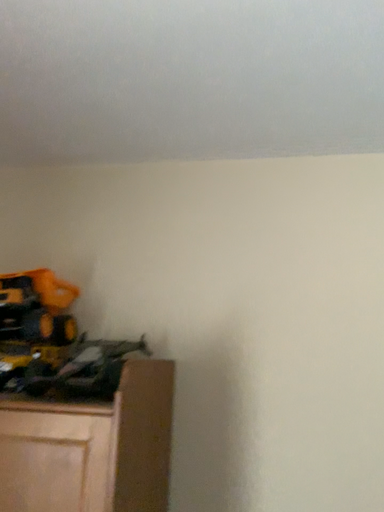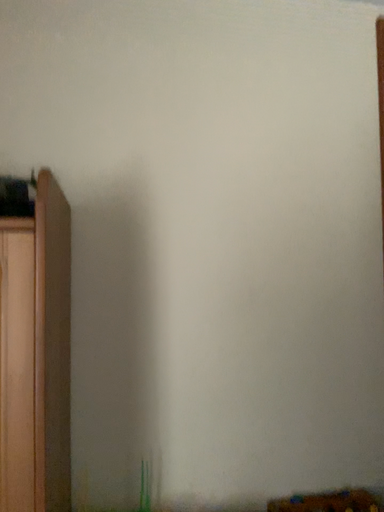
Question: How did the camera likely rotate when shooting the video?

Choices:
 (A) rotated upward
 (B) rotated downward

Answer: (B)